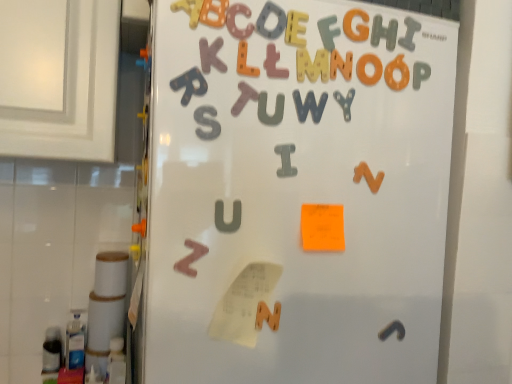
Question: Is orange matte letter g at upper center, arranged as the 2th letter when viewed from the right, taller than matte pink letter at center, the 5th letter positioned from the left?

Choices:
 (A) yes
 (B) no

Answer: (B)

Question: Does orange matte letter g at upper center, arranged as the 2th letter when viewed from the right, have a greater width compared to matte pink letter at center, the 5th letter positioned from the right?

Choices:
 (A) no
 (B) yes

Answer: (A)

Question: Considering the relative sizes of orange matte letter g at upper center, arranged as the 2th letter when viewed from the right, and matte pink letter at center, the 5th letter positioned from the left, in the image provided, is orange matte letter g at upper center, arranged as the 2th letter when viewed from the right, shorter than matte pink letter at center, the 5th letter positioned from the left,?

Choices:
 (A) no
 (B) yes

Answer: (B)

Question: Can you confirm if orange matte letter g at upper center, the 8th letter from the left, is smaller than matte pink letter at center, the 5th letter positioned from the left?

Choices:
 (A) yes
 (B) no

Answer: (B)

Question: From a real-world perspective, is orange matte letter g at upper center, the 8th letter from the left, over matte pink letter at center, the 5th letter positioned from the left?

Choices:
 (A) no
 (B) yes

Answer: (B)

Question: Considering the positions of point (276, 57) and point (324, 44), is point (276, 57) closer or farther from the camera than point (324, 44)?

Choices:
 (A) farther
 (B) closer

Answer: (B)

Question: In terms of height, does matte pink letter at center, the 5th letter positioned from the left, look taller or shorter compared to matte wooden letter at upper center, the 6th letter when ordered from left to right?

Choices:
 (A) short
 (B) tall

Answer: (A)

Question: Considering the positions of matte pink letter at center, the 5th letter positioned from the right, and matte wooden letter at upper center, the 6th letter when ordered from left to right, in the image, is matte pink letter at center, the 5th letter positioned from the right, bigger or smaller than matte wooden letter at upper center, the 6th letter when ordered from left to right,?

Choices:
 (A) small
 (B) big

Answer: (A)

Question: From the image's perspective, is matte pink letter at center, the 5th letter positioned from the left, positioned above or below matte wooden letter at upper center, the 6th letter when ordered from left to right?

Choices:
 (A) below
 (B) above

Answer: (A)

Question: Is matte pink letter at center, the 5th letter positioned from the right, in front of or behind wooden letter at upper center, which is the 9th letter from right to left, in the image?

Choices:
 (A) front
 (B) behind

Answer: (B)

Question: From a real-world perspective, is matte pink letter at center, the 5th letter positioned from the left, above or below wooden letter at upper center, which is the 9th letter from right to left?

Choices:
 (A) above
 (B) below

Answer: (B)

Question: Considering the positions of point (276, 74) and point (194, 26), is point (276, 74) closer or farther from the camera than point (194, 26)?

Choices:
 (A) farther
 (B) closer

Answer: (A)

Question: Is matte pink letter at center, the 5th letter positioned from the right, to the left or to the right of wooden letter at upper center, which is the 9th letter from right to left, in the image?

Choices:
 (A) right
 (B) left

Answer: (A)

Question: From a real-world perspective, is brown wooden letter z at lower left, the second alphabet from the front, above or below metallic silver letter y at upper center, the fourth alphabet when ordered from bottom to top?

Choices:
 (A) above
 (B) below

Answer: (B)

Question: Looking at the image, does brown wooden letter z at lower left, the second alphabet from the front, seem bigger or smaller compared to metallic silver letter y at upper center, which appears as the 2th alphabet when viewed from the right?

Choices:
 (A) small
 (B) big

Answer: (B)